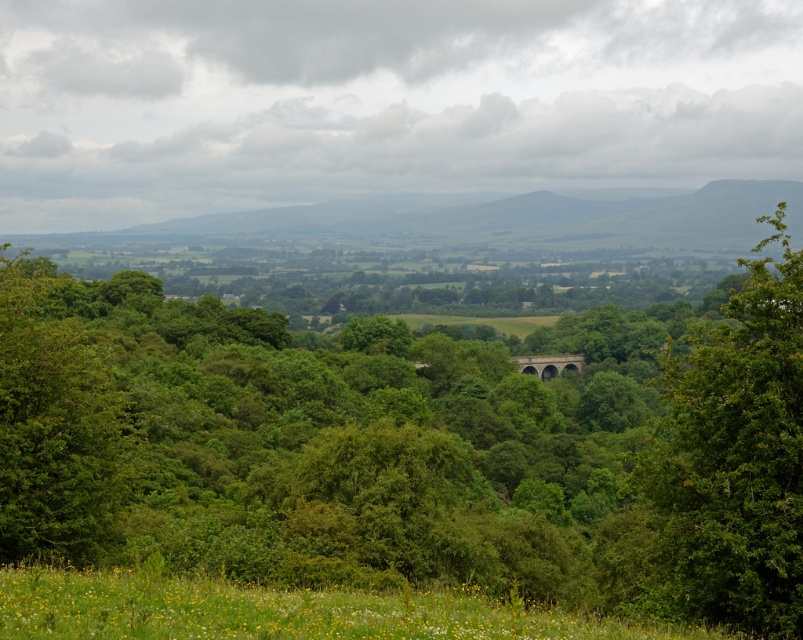
Is green leafy tree at right further to camera compared to green stone arch bridge at center?

Result: No, green leafy tree at right is in front of green stone arch bridge at center.

The width and height of the screenshot is (803, 640). What do you see at coordinates (736, 456) in the screenshot?
I see `green leafy tree at right` at bounding box center [736, 456].

Locate an element on the screen. The width and height of the screenshot is (803, 640). green leafy tree at right is located at coordinates pos(736,456).

Is green leafy tree at center to the left of green stone arch bridge at center from the viewer's perspective?

Correct, you'll find green leafy tree at center to the left of green stone arch bridge at center.

Who is more forward, (x=45, y=372) or (x=577, y=356)?

Positioned in front is point (x=45, y=372).

You are a GUI agent. You are given a task and a screenshot of the screen. Output one action in this format:
    pyautogui.click(x=<x>, y=<y>)
    Task: Click on the green leafy tree at center
    
    Given the screenshot: What is the action you would take?
    pyautogui.click(x=414, y=445)

Locate an element on the screen. green leafy tree at center is located at coordinates pyautogui.click(x=414, y=445).

Between point (667, 477) and point (732, 470), which one is positioned behind?

Positioned behind is point (667, 477).

Who is more forward, (321, 387) or (771, 355)?

Point (771, 355) is more forward.

Locate an element on the screen. Image resolution: width=803 pixels, height=640 pixels. green leafy tree at center is located at coordinates (414, 445).